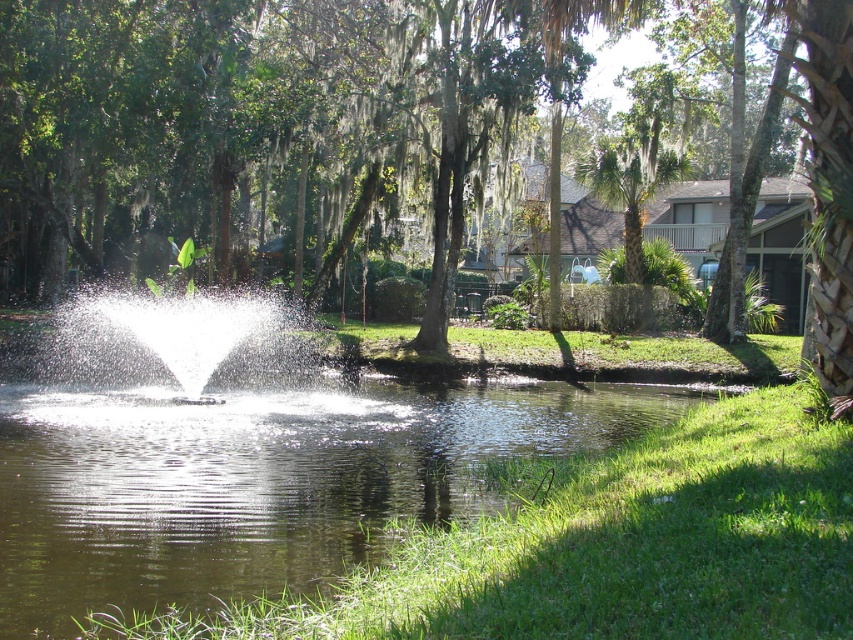
You are standing at point (268, 122) in the scene. Based on the description, what object is located exactly at your current position?

The green mossy tree at center is located exactly at point (268, 122).

You are standing at the edge of the pond and want to see the clear water at center. Which direction should you look relative to the white water at center?

The clear water at center is in front of the white water at center, so you should look towards the direction where the clear water is located, which is closer to you compared to the white water at center.

You are standing at the edge of the pond and see both the clear water at center and the white water at center. Which one is located to the right of the other?

The clear water at center is positioned on the right side of white water at center.